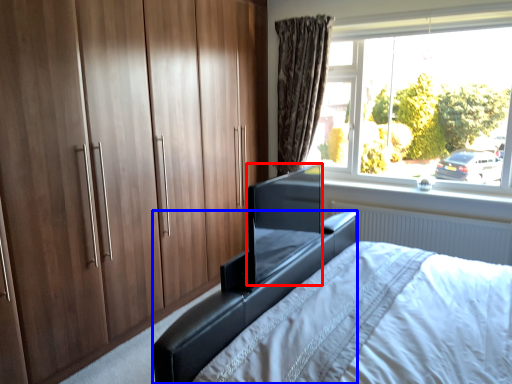
Question: Which of the following is the closest to the observer, window screen (highlighted by a red box) or bed frame (highlighted by a blue box)?

Choices:
 (A) window screen
 (B) bed frame

Answer: (B)